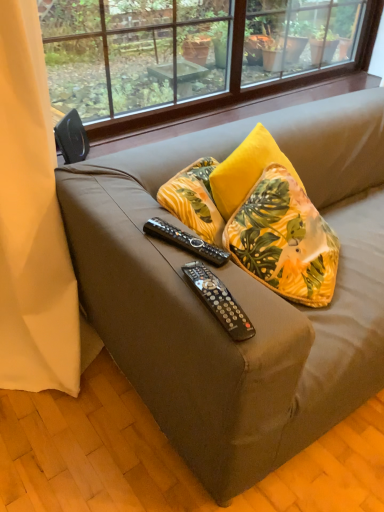
This screenshot has height=512, width=384. I want to click on free space behind black plastic remote control at center, positioned as the 2th remote control in front-to-back order, so click(x=173, y=199).